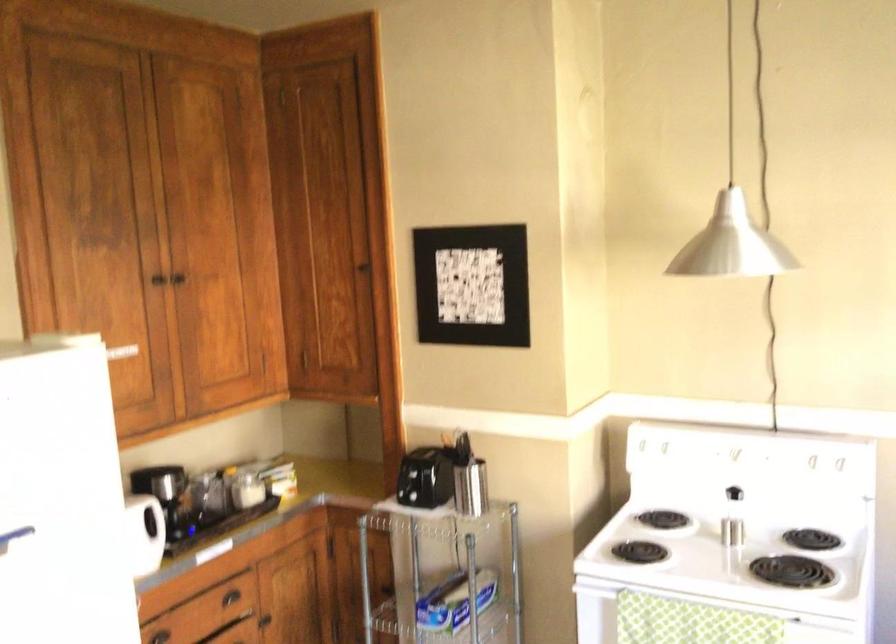
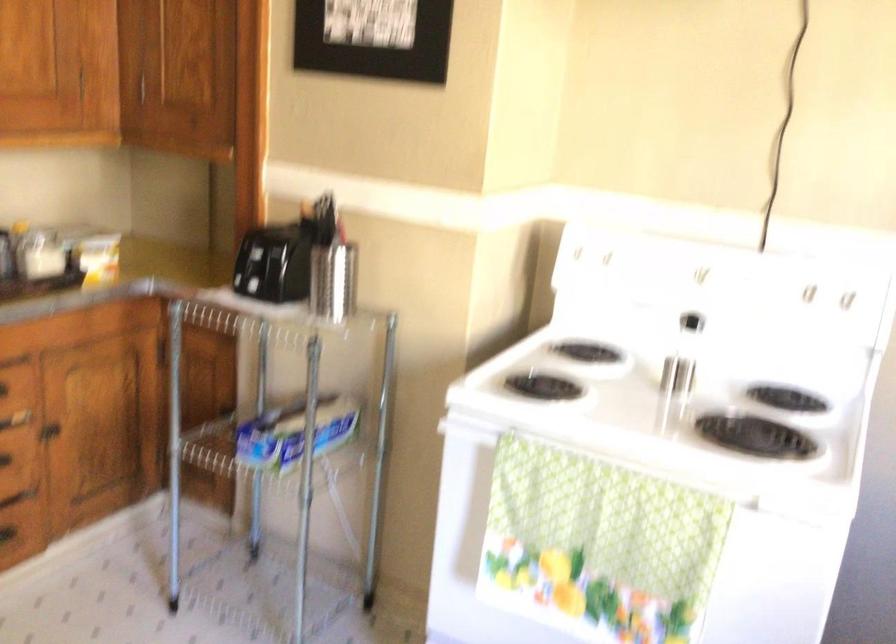
Find the pixel in the second image that matches point (642, 444) in the first image.

(576, 252)